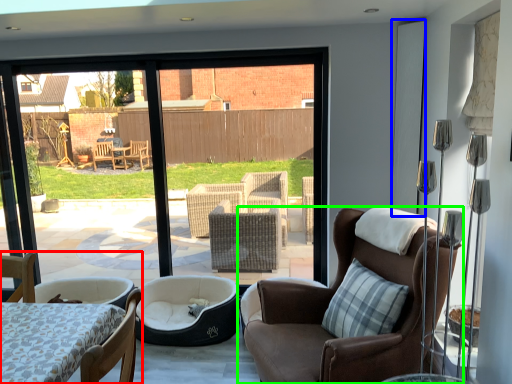
Question: Which is nearer to the chair (highlighted by a red box)? screen door (highlighted by a blue box) or chair (highlighted by a green box).

Choices:
 (A) screen door
 (B) chair

Answer: (B)